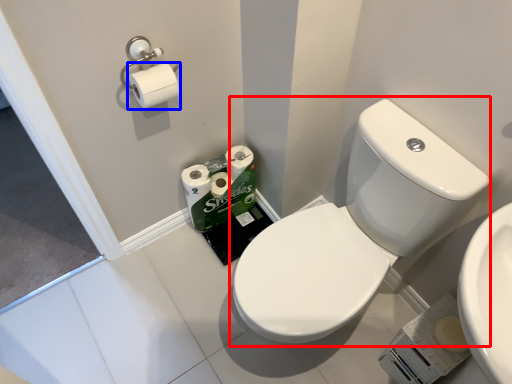
Question: Which object is closer to the camera taking this photo, sink (highlighted by a red box) or toilet paper (highlighted by a blue box)?

Choices:
 (A) sink
 (B) toilet paper

Answer: (A)